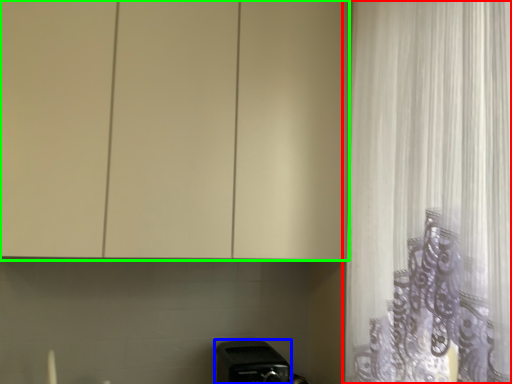
Question: Which object is positioned closest to curtain (highlighted by a red box)? Select from appliance (highlighted by a blue box) and cabinetry (highlighted by a green box).

Choices:
 (A) appliance
 (B) cabinetry

Answer: (B)